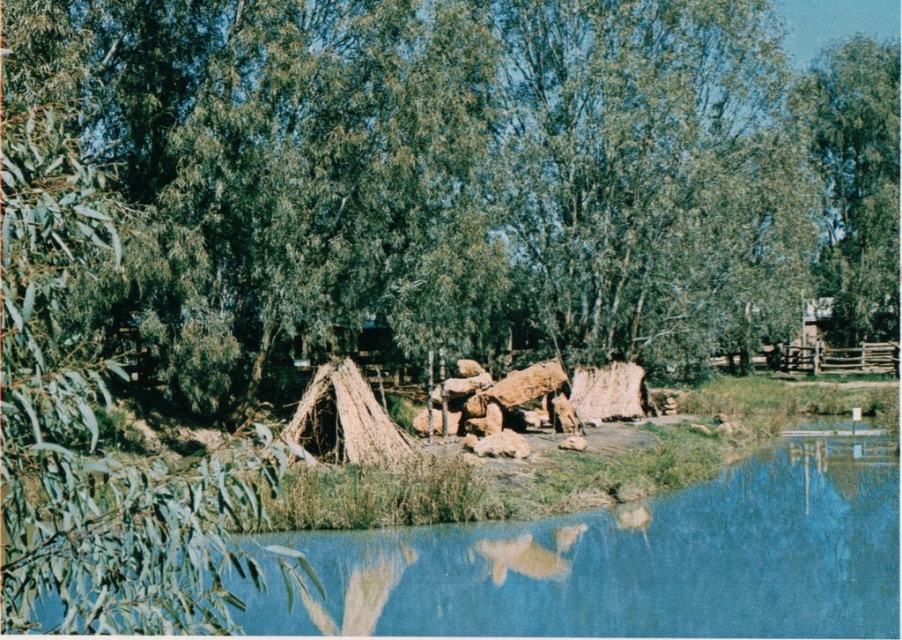
Which is below, blue water at lower center or green leafy tree at upper right?

blue water at lower center

Between blue water at lower center and green leafy tree at upper right, which one appears on the right side from the viewer's perspective?

From the viewer's perspective, green leafy tree at upper right appears more on the right side.

This screenshot has width=902, height=640. I want to click on blue water at lower center, so click(x=629, y=561).

Identify the location of blue water at lower center. (629, 561).